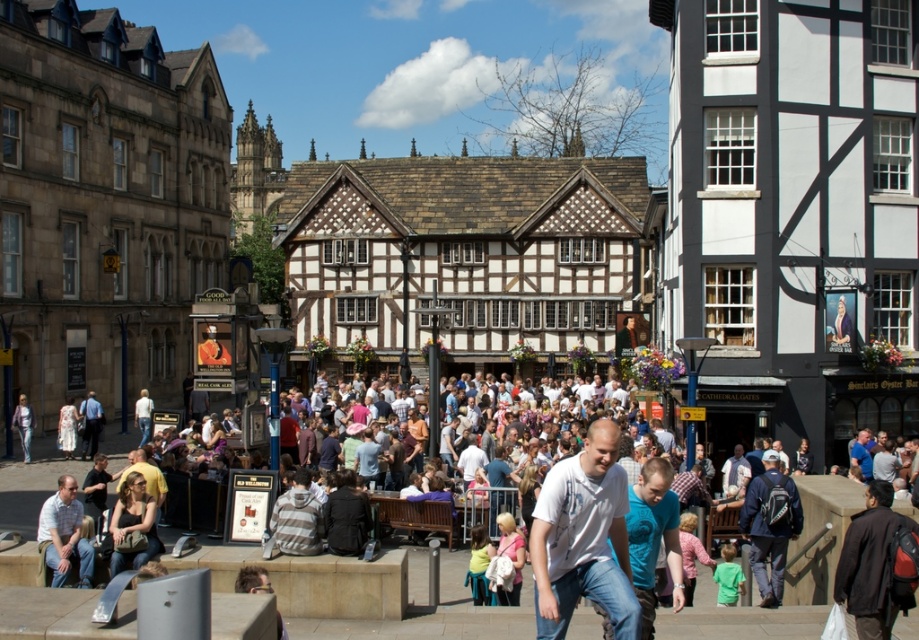
You are a photographer standing in the town square and want to capture both the dark brown leather jacket at lower right and the striped hoodie at center in a single frame. Which clothing item will appear bigger in the photo?

The dark brown leather jacket at lower right will appear bigger in the photo because it has a larger size compared to the striped hoodie at center.

You are a photographer at the town square and want to capture both the multicolored casual attire at center and the striped hoodie at center in a single frame. Which one should you position closer to the left side of your camera viewfinder to include both effectively?

To include both the multicolored casual attire at center and the striped hoodie at center effectively, position the multicolored casual attire at center closer to the left side of your camera viewfinder since it is already to the left of the striped hoodie at center in the scene.